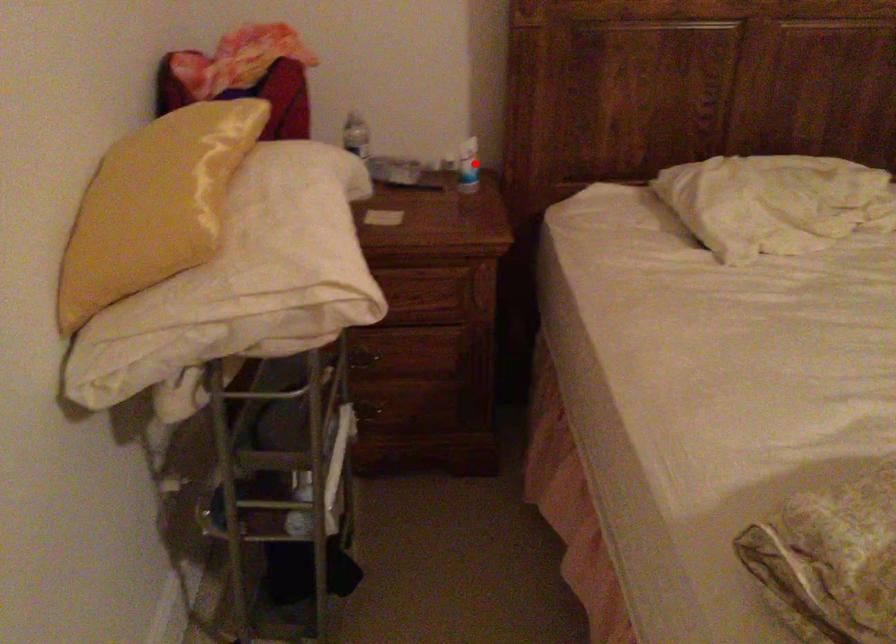
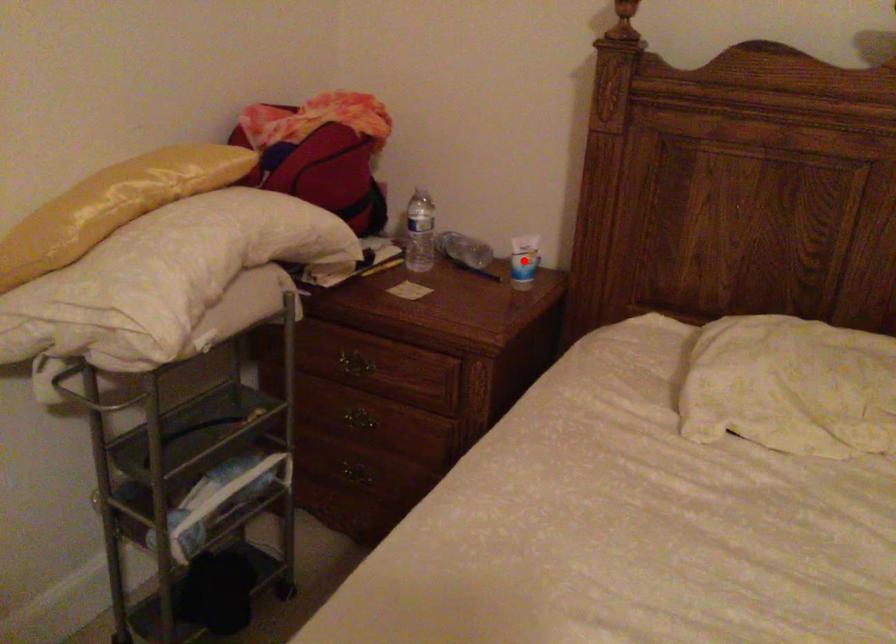
I am providing you with two images of the same scene from different viewpoints. A red point is marked on the first image and another point is marked on the second image. Do the highlighted points in image1 and image2 indicate the same real-world spot?

Yes